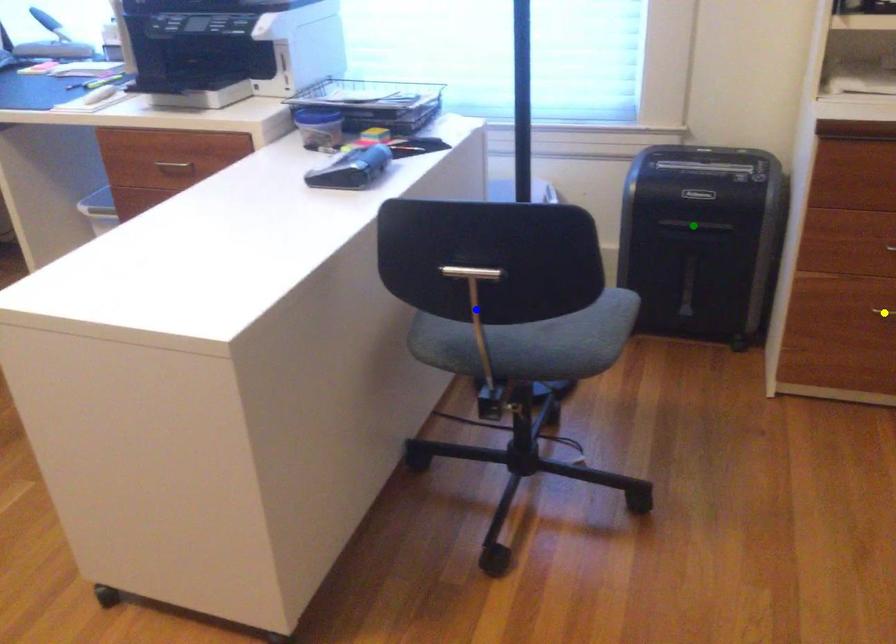
Order these from nearest to farthest:
blue point, green point, yellow point

blue point, yellow point, green point